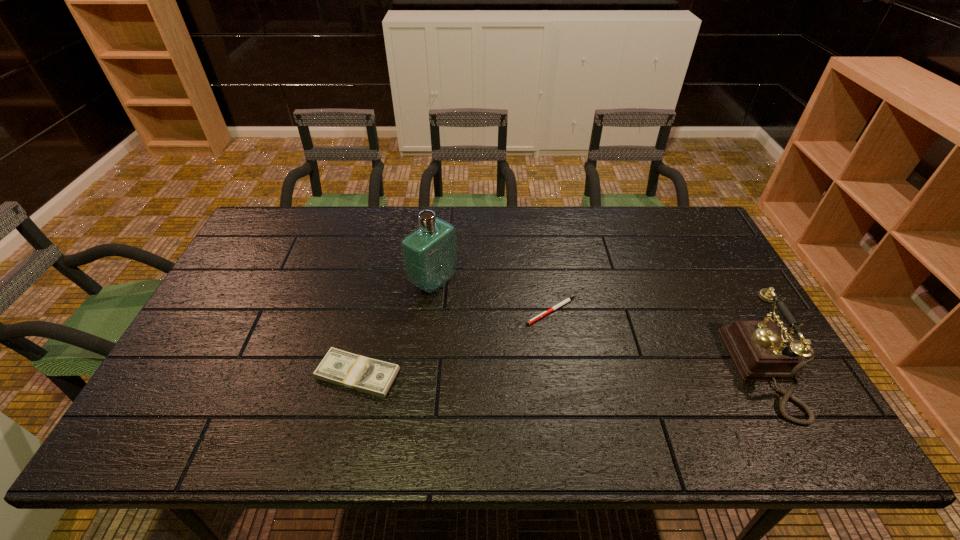
You are a GUI agent. You are given a task and a screenshot of the screen. Output one action in this format:
    pyautogui.click(x=<x>, y=<y>)
    Task: Click on the free space on the desktop that is between the dollar and the second tallest object and is positioned on the front label of the tallest object
    This screenshot has height=540, width=960.
    Given the screenshot: What is the action you would take?
    pyautogui.click(x=583, y=372)

Locate an element on the screen. vacant space on the desktop that is between the third tallest object and the telephone and is positioned on the clicker of the third object from left to right is located at coordinates (526, 373).